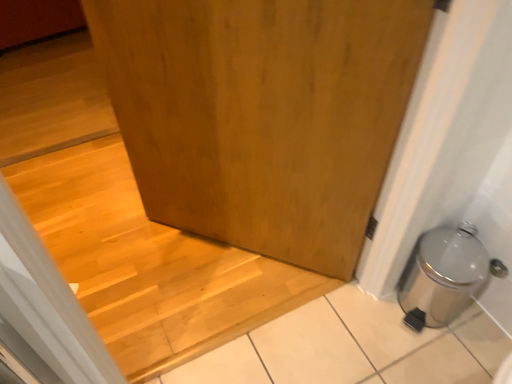
Question: Can you confirm if wooden door at center is thinner than wooden at center?

Choices:
 (A) no
 (B) yes

Answer: (B)

Question: Is wooden door at center directly adjacent to wooden at center?

Choices:
 (A) yes
 (B) no

Answer: (B)

Question: Is wooden at center located within wooden door at center?

Choices:
 (A) no
 (B) yes

Answer: (A)

Question: Is the depth of wooden door at center less than that of wooden at center?

Choices:
 (A) no
 (B) yes

Answer: (B)

Question: Does wooden door at center turn towards wooden at center?

Choices:
 (A) no
 (B) yes

Answer: (A)

Question: Is wooden door at center taller than wooden at center?

Choices:
 (A) yes
 (B) no

Answer: (A)

Question: Is wooden at center to the left of wooden door at center from the viewer's perspective?

Choices:
 (A) yes
 (B) no

Answer: (A)

Question: Can you see wooden at center touching wooden door at center?

Choices:
 (A) no
 (B) yes

Answer: (A)

Question: Does wooden at center have a greater height compared to wooden door at center?

Choices:
 (A) no
 (B) yes

Answer: (A)

Question: Is wooden at center positioned far away from wooden door at center?

Choices:
 (A) no
 (B) yes

Answer: (A)

Question: From a real-world perspective, is wooden at center located higher than wooden door at center?

Choices:
 (A) no
 (B) yes

Answer: (A)

Question: Is wooden at center not within wooden door at center?

Choices:
 (A) no
 (B) yes

Answer: (B)

Question: Can you confirm if silver metallic trash can at lower right is thinner than wooden door at center?

Choices:
 (A) yes
 (B) no

Answer: (B)